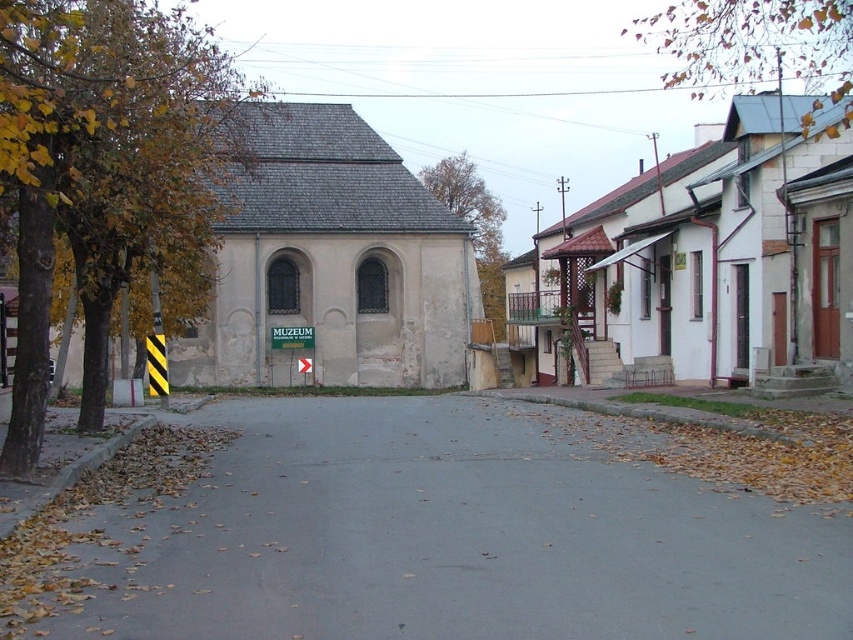
Does gray asphalt road at center appear on the right side of green plastic sign at center?

Yes, gray asphalt road at center is to the right of green plastic sign at center.

Who is positioned more to the right, gray asphalt road at center or green plastic sign at center?

gray asphalt road at center

This screenshot has height=640, width=853. What do you see at coordinates (421, 532) in the screenshot? I see `gray asphalt road at center` at bounding box center [421, 532].

Find the location of a particular element. gray asphalt road at center is located at coordinates (421, 532).

Is gray stone church at center in front of green leafy tree at upper center?

That is True.

Identify the location of gray stone church at center. This screenshot has width=853, height=640. (334, 260).

Which is below, gray asphalt road at center or green leafy tree at upper center?

gray asphalt road at center

Between gray asphalt road at center and green leafy tree at upper center, which one has less height?

Standing shorter between the two is gray asphalt road at center.

Describe the element at coordinates (421, 532) in the screenshot. The image size is (853, 640). I see `gray asphalt road at center` at that location.

The width and height of the screenshot is (853, 640). In order to click on gray asphalt road at center in this screenshot , I will do `click(421, 532)`.